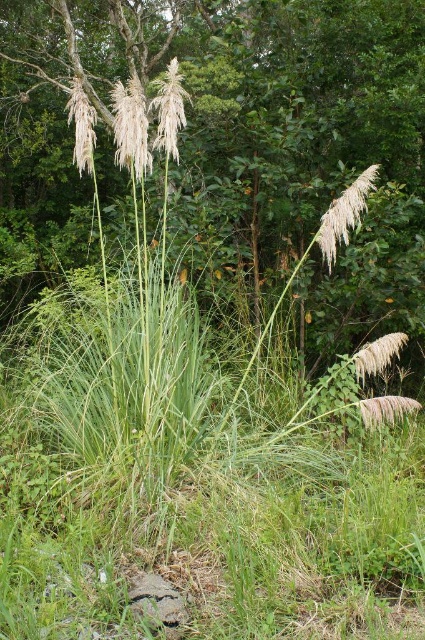
You are a gardener trying to identify plants in the image. You notice two types of grasses. Which one is bigger in size between the green grass at center and the white fluffy grass at upper right?

The green grass at center is larger in size compared to the white fluffy grass at upper right.

You are standing in the center of the image and want to locate the white fluffy grass at upper right. Based on the coordinates provided, in which direction should you look to find it?

The white fluffy grass at upper right is located at coordinates point (345, 214), which means you should look towards the upper right direction to find it.